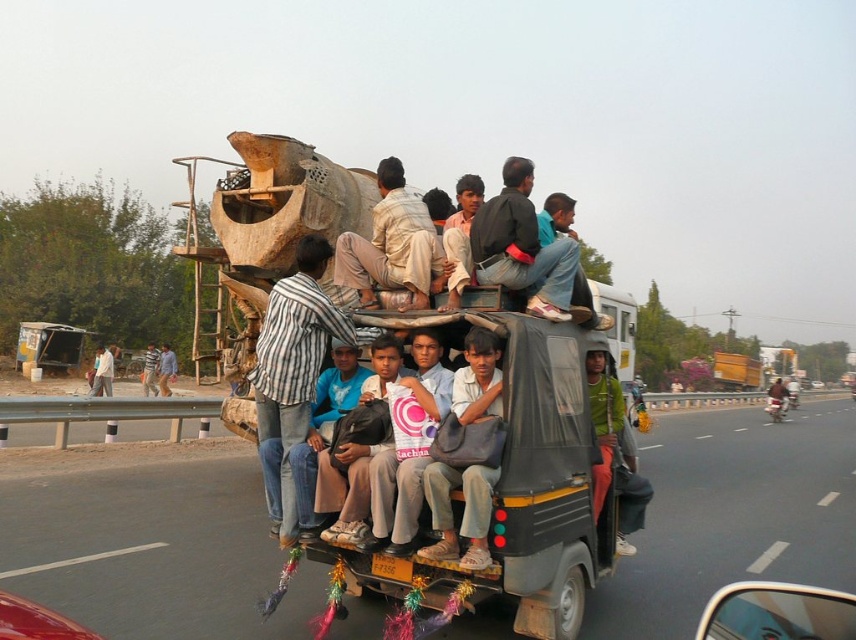
You are a pedestrian standing at the edge of the road. You see a light brown fabric shirt at center and a brushed metal motorcycle at center. How far apart are these two objects from each other?

The light brown fabric shirt at center is 26.45 meters away from the brushed metal motorcycle at center.

You are a photographer standing on the sidewalk. You want to take a photo of the brushed metal motorcycle at center and the light brown fabric shirt at center. Based on their positions, which object should you focus on first to ensure both are in frame?

You should focus on the brushed metal motorcycle at center first because the light brown fabric shirt at center is to the left of it, so adjusting the camera to include both would require framing from the motorcycle outward.

In the scene shown: You are a tailor who needs to determine which item of clothing has a larger width for a customer. You see the dark blue jeans at center and the light brown fabric shirt at center in the image. Which one has a greater width?

The light brown fabric shirt at center has a greater width than the dark blue jeans at center according to the description.